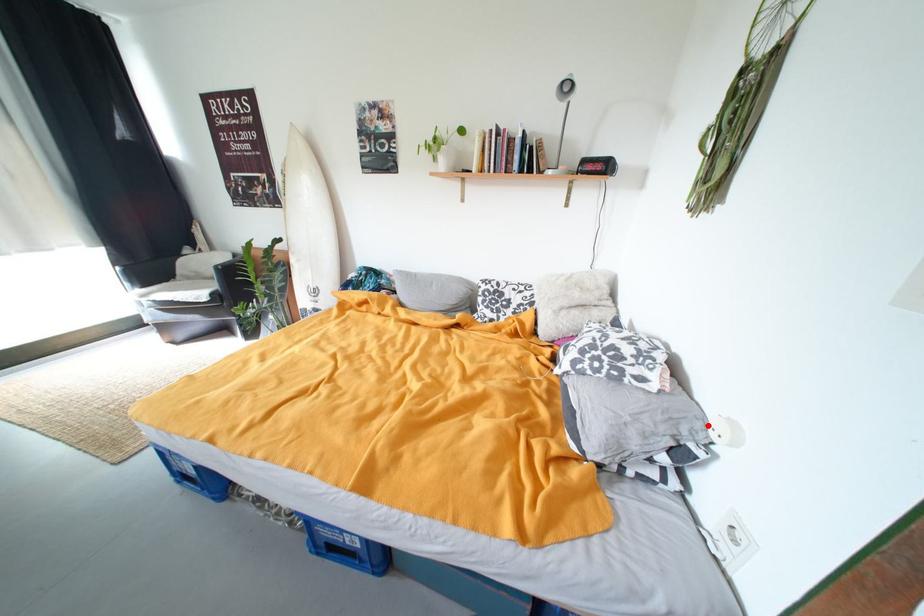
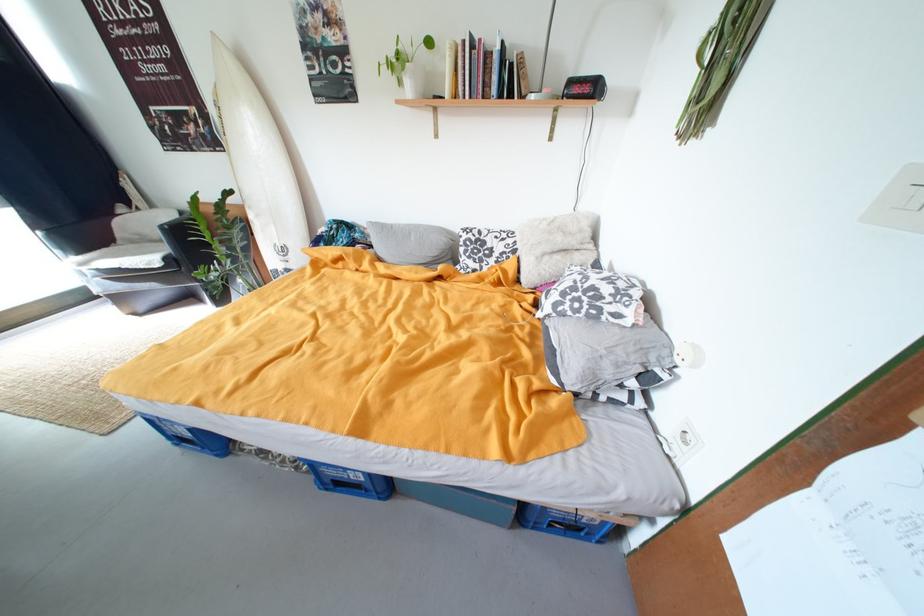
Where in the second image is the point corresponding to the highlighted location from the first image?

(675, 353)